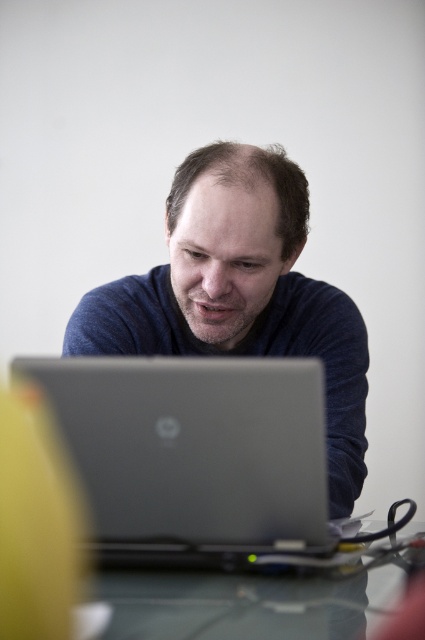
Question: Based on their relative distances, which object is nearer to the clear glass table at center?

Choices:
 (A) matte blue sweater at center
 (B) silver metallic laptop at center

Answer: (B)

Question: Can you confirm if silver metallic laptop at center is smaller than clear glass table at center?

Choices:
 (A) no
 (B) yes

Answer: (A)

Question: Can you confirm if silver metallic laptop at center is thinner than clear glass table at center?

Choices:
 (A) yes
 (B) no

Answer: (A)

Question: Among these points, which one is farthest from the camera?

Choices:
 (A) pos(226,436)
 (B) pos(116,349)

Answer: (B)

Question: Can you confirm if silver metallic laptop at center is positioned to the right of matte blue sweater at center?

Choices:
 (A) no
 (B) yes

Answer: (A)

Question: Which of the following is the closest to the observer?

Choices:
 (A) (180, 195)
 (B) (263, 573)
 (C) (153, 554)

Answer: (B)